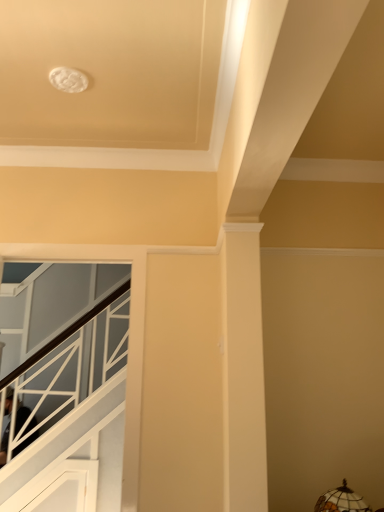
In order to face white glossy stairwell at left, should I rotate leftwards or rightwards?

Turn left by 17.820 degrees to look at white glossy stairwell at left.

Where is `white glossy stairwell at left`? This screenshot has width=384, height=512. white glossy stairwell at left is located at coordinates (73, 459).

The image size is (384, 512). What do you see at coordinates (73, 459) in the screenshot? I see `white glossy stairwell at left` at bounding box center [73, 459].

Measure the distance between stained glass lampshade at lower right and camera.

The distance of stained glass lampshade at lower right from camera is 5.66 feet.

You are a GUI agent. You are given a task and a screenshot of the screen. Output one action in this format:
    pyautogui.click(x=<x>, y=<y>)
    Task: Click on the stained glass lampshade at lower right
    The height and width of the screenshot is (512, 384).
    Given the screenshot: What is the action you would take?
    pyautogui.click(x=341, y=501)

The image size is (384, 512). What do you see at coordinates (341, 501) in the screenshot?
I see `stained glass lampshade at lower right` at bounding box center [341, 501].

Identify the location of white glossy stairwell at left. (73, 459).

Considering the positions of objects white glossy stairwell at left and stained glass lampshade at lower right in the image provided, who is more to the left, white glossy stairwell at left or stained glass lampshade at lower right?

white glossy stairwell at left.

Which is in front, white glossy stairwell at left or stained glass lampshade at lower right?

stained glass lampshade at lower right is in front.

Is point (35, 496) in front of point (332, 507)?

That is False.

From the image's perspective, is white glossy stairwell at left located above stained glass lampshade at lower right?

No, from the image's perspective, white glossy stairwell at left is not over stained glass lampshade at lower right.

From a real-world perspective, which object stands above the other?

From a 3D spatial view, white glossy stairwell at left is above.

Is white glossy stairwell at left thinner than stained glass lampshade at lower right?

Indeed, white glossy stairwell at left has a lesser width compared to stained glass lampshade at lower right.

Which of these two, white glossy stairwell at left or stained glass lampshade at lower right, stands shorter?

stained glass lampshade at lower right is shorter.

Which of these two, white glossy stairwell at left or stained glass lampshade at lower right, is smaller?

With smaller size is stained glass lampshade at lower right.

Based on the photo, which is correct: white glossy stairwell at left is inside stained glass lampshade at lower right, or outside of it?

white glossy stairwell at left cannot be found inside stained glass lampshade at lower right.

Is white glossy stairwell at left far from stained glass lampshade at lower right?

white glossy stairwell at left is positioned a significant distance from stained glass lampshade at lower right.

Is white glossy stairwell at left turned away from stained glass lampshade at lower right?

That's not correct — white glossy stairwell at left is not looking away from stained glass lampshade at lower right.

How many degrees apart are the facing directions of white glossy stairwell at left and stained glass lampshade at lower right?

Answer: white glossy stairwell at left and stained glass lampshade at lower right are facing 4.76 degrees away from each other.

You are a GUI agent. You are given a task and a screenshot of the screen. Output one action in this format:
    pyautogui.click(x=<x>, y=<y>)
    Task: Click on the stairwell below the stained glass lampshade at lower right (from the image's perspective)
    This screenshot has width=384, height=512.
    Given the screenshot: What is the action you would take?
    pyautogui.click(x=73, y=459)

Does stained glass lampshade at lower right appear on the left side of white glossy stairwell at left?

No, stained glass lampshade at lower right is not to the left of white glossy stairwell at left.

Considering the relative positions of stained glass lampshade at lower right and white glossy stairwell at left in the image provided, is stained glass lampshade at lower right behind white glossy stairwell at left?

No, stained glass lampshade at lower right is closer to the camera.

Between point (330, 511) and point (104, 498), which one is positioned behind?

The point (104, 498) is farther.

From the image's perspective, is stained glass lampshade at lower right under white glossy stairwell at left?

Actually, stained glass lampshade at lower right appears above white glossy stairwell at left in the image.

From a real-world perspective, which object rests below the other?

stained glass lampshade at lower right is physically lower.

Is stained glass lampshade at lower right wider or thinner than white glossy stairwell at left?

Clearly, stained glass lampshade at lower right has more width compared to white glossy stairwell at left.

Considering the sizes of objects stained glass lampshade at lower right and white glossy stairwell at left in the image provided, who is shorter, stained glass lampshade at lower right or white glossy stairwell at left?

Standing shorter between the two is stained glass lampshade at lower right.

In terms of size, does stained glass lampshade at lower right appear bigger or smaller than white glossy stairwell at left?

Considering their sizes, stained glass lampshade at lower right takes up less space than white glossy stairwell at left.

Is white glossy stairwell at left a part of stained glass lampshade at lower right?

No, stained glass lampshade at lower right does not contain white glossy stairwell at left.

Are stained glass lampshade at lower right and white glossy stairwell at left far apart?

Yes, stained glass lampshade at lower right and white glossy stairwell at left are located far from each other.

Is white glossy stairwell at left at the back of stained glass lampshade at lower right?

No, stained glass lampshade at lower right is not facing the opposite direction of white glossy stairwell at left.

Locate an element on the screen. This screenshot has width=384, height=512. stairwell above the stained glass lampshade at lower right (from a real-world perspective) is located at coordinates (73, 459).

You are a GUI agent. You are given a task and a screenshot of the screen. Output one action in this format:
    pyautogui.click(x=<x>, y=<y>)
    Task: Click on the lamp in front of the white glossy stairwell at left
    The image size is (384, 512).
    Given the screenshot: What is the action you would take?
    pyautogui.click(x=341, y=501)

You are a GUI agent. You are given a task and a screenshot of the screen. Output one action in this format:
    pyautogui.click(x=<x>, y=<y>)
    Task: Click on the stairwell above the stained glass lampshade at lower right (from a real-world perspective)
    
    Given the screenshot: What is the action you would take?
    pyautogui.click(x=73, y=459)